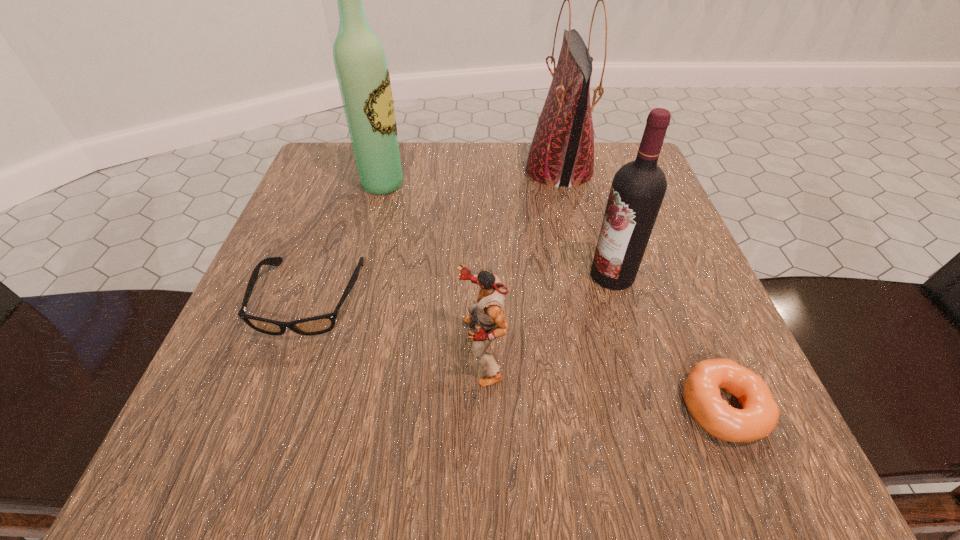
This screenshot has height=540, width=960. I want to click on vacant region between the handbag and the shorter wine bottle, so 586,222.

You are a GUI agent. You are given a task and a screenshot of the screen. Output one action in this format:
    pyautogui.click(x=<x>, y=<y>)
    Task: Click on the unoccupied area between the spectacles and the tallest object
    The height and width of the screenshot is (540, 960).
    Given the screenshot: What is the action you would take?
    pyautogui.click(x=347, y=241)

Identify the location of unoccupied area between the fourth tallest object and the left wine bottle. The height and width of the screenshot is (540, 960). (432, 267).

Identify the location of vacant region between the right wine bottle and the spectacles. Image resolution: width=960 pixels, height=540 pixels. (461, 286).

Identify the location of free space between the spectacles and the nearer wine bottle. This screenshot has height=540, width=960. (461, 286).

I want to click on vacant area between the spectacles and the fourth object from right to left, so click(396, 324).

Image resolution: width=960 pixels, height=540 pixels. In order to click on free space between the fourth shortest object and the rightmost object in this screenshot , I will do `click(667, 341)`.

At what (x,y) coordinates should I click in order to perform the action: click on free spot between the handbag and the third shortest object. Please return your answer as a coordinate pair (x, y). The height and width of the screenshot is (540, 960). Looking at the image, I should click on (520, 260).

Image resolution: width=960 pixels, height=540 pixels. In order to click on object that is the fifth closest to the fourth shortest object in this screenshot , I will do `click(362, 72)`.

Image resolution: width=960 pixels, height=540 pixels. In order to click on object that stands as the fourth closest to the handbag in this screenshot , I will do point(317,325).